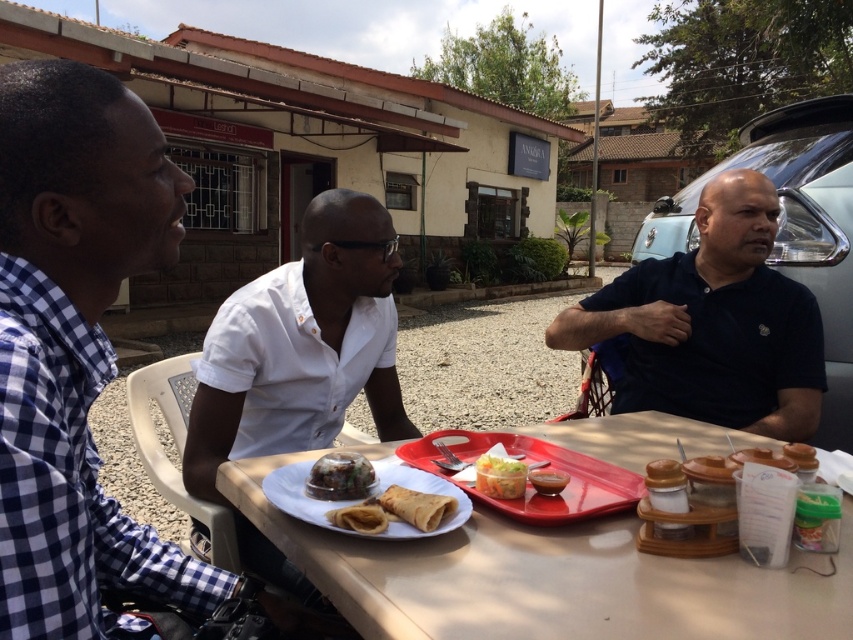
Which is more to the left, checkered fabric shirt at left or golden crispy crepe at center?

checkered fabric shirt at left

Does checkered fabric shirt at left appear on the right side of golden crispy crepe at center?

Incorrect, checkered fabric shirt at left is not on the right side of golden crispy crepe at center.

Is point (18, 284) closer to viewer compared to point (442, 497)?

Yes, it is in front of point (442, 497).

This screenshot has width=853, height=640. What are the coordinates of `checkered fabric shirt at left` in the screenshot? It's located at (74, 346).

Is red plastic tray at center positioned behind smokey brown sauce at center?

No, red plastic tray at center is closer to the viewer.

What do you see at coordinates (531, 484) in the screenshot? I see `red plastic tray at center` at bounding box center [531, 484].

The width and height of the screenshot is (853, 640). What are the coordinates of `red plastic tray at center` in the screenshot? It's located at (531, 484).

Identify the location of red plastic tray at center. The height and width of the screenshot is (640, 853). (531, 484).

Looking at this image, how much distance is there between checkered fabric shirt at left and smokey brown sauce at center?

checkered fabric shirt at left is 29.08 inches away from smokey brown sauce at center.

At what (x,y) coordinates should I click in order to perform the action: click on checkered fabric shirt at left. Please return your answer as a coordinate pair (x, y). Looking at the image, I should click on coord(74,346).